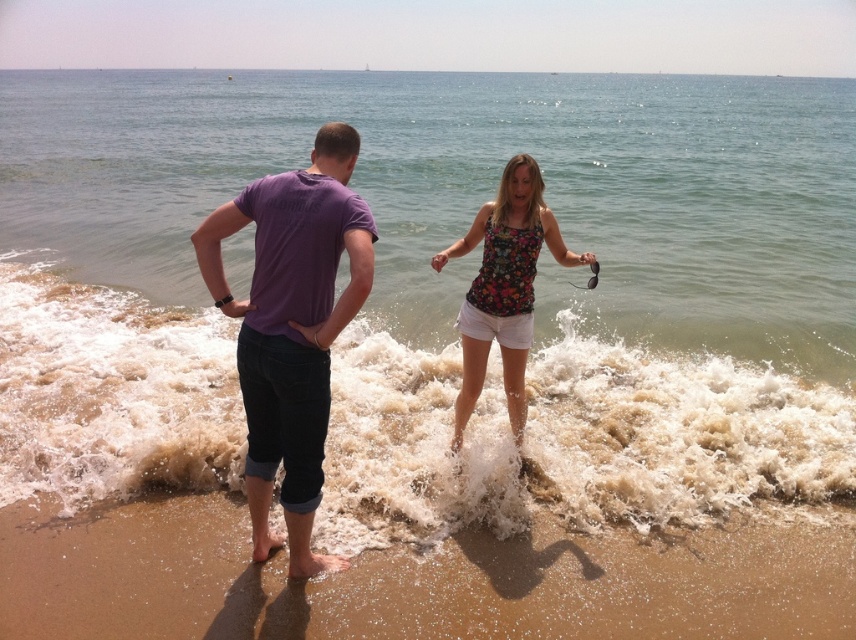
Is clear water at lower center positioned at the back of floral fabric tank top at center?

No, clear water at lower center is closer to the viewer.

Is point (803, 104) farther from camera compared to point (488, 282)?

Yes, it is.

This screenshot has height=640, width=856. I want to click on clear water at lower center, so pyautogui.click(x=473, y=192).

This screenshot has width=856, height=640. What do you see at coordinates (412, 580) in the screenshot?
I see `brown sand at lower left` at bounding box center [412, 580].

The width and height of the screenshot is (856, 640). Identify the location of brown sand at lower left. (412, 580).

Identify the location of brown sand at lower left. [x=412, y=580].

This screenshot has height=640, width=856. I want to click on brown sand at lower left, so click(412, 580).

Does point (314, 163) lie in front of point (520, 282)?

Yes, point (314, 163) is in front of point (520, 282).

Image resolution: width=856 pixels, height=640 pixels. I want to click on purple cotton shirt at center, so click(292, 326).